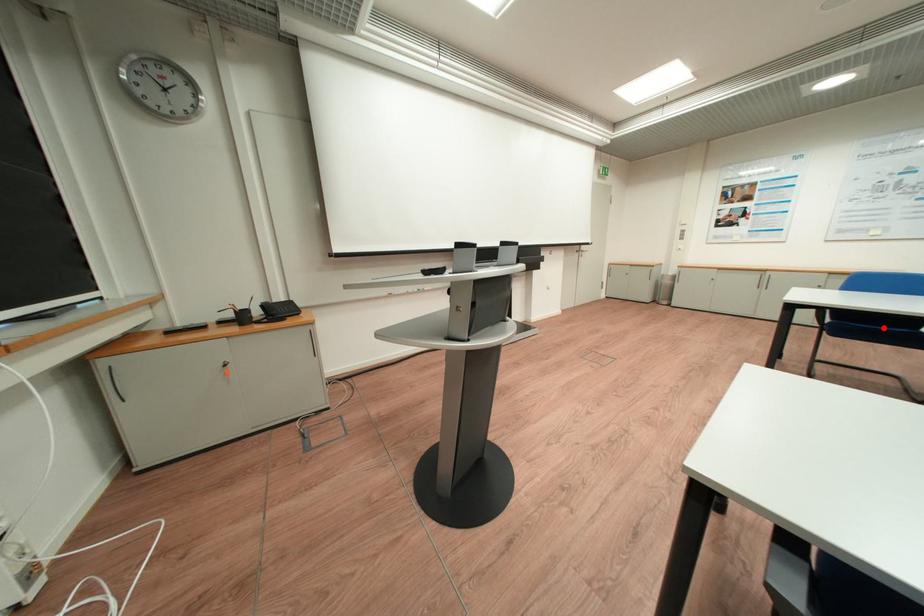
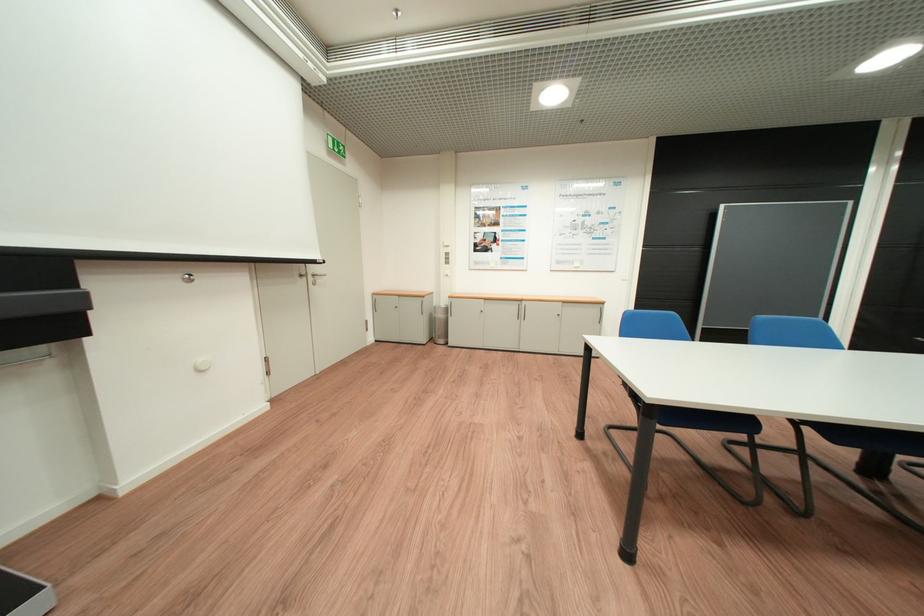
Question: I am providing you with two images of the same scene from different viewpoints. A red point is marked on the first image. At the location where the point appears in image 1, is it still visible in image 2?

Choices:
 (A) Yes
 (B) No

Answer: (B)